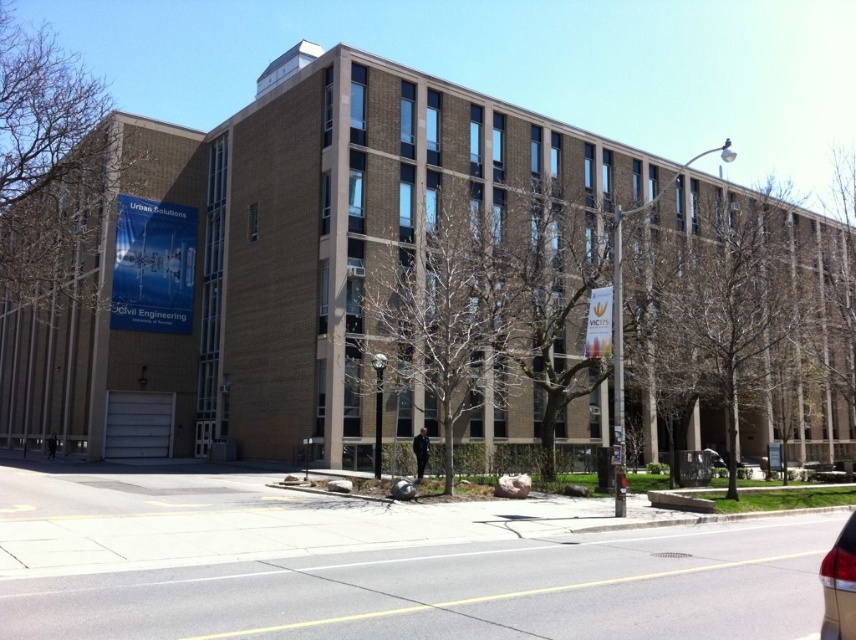
Is brown brick building at center shorter than shiny red tail light at lower right?

In fact, brown brick building at center may be taller than shiny red tail light at lower right.

Which of these two, brown brick building at center or shiny red tail light at lower right, stands shorter?

shiny red tail light at lower right

The image size is (856, 640). Describe the element at coordinates (281, 257) in the screenshot. I see `brown brick building at center` at that location.

Image resolution: width=856 pixels, height=640 pixels. I want to click on brown brick building at center, so click(281, 257).